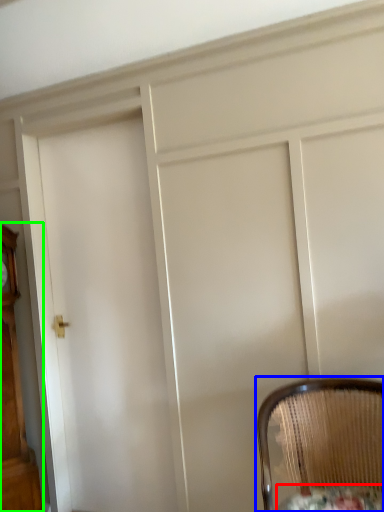
Question: Considering the real-world distances, which object is farthest from round table (highlighted by a red box)? chair (highlighted by a blue box) or furniture (highlighted by a green box)?

Choices:
 (A) chair
 (B) furniture

Answer: (B)